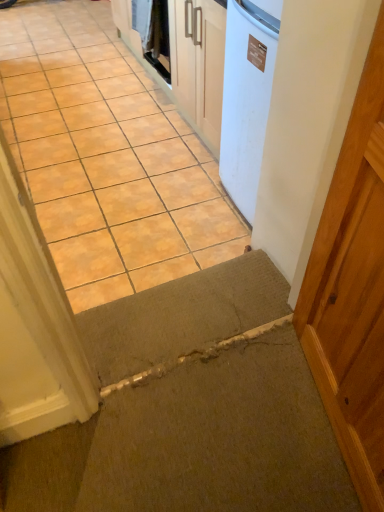
Question: Is white glossy washing machine at upper center bigger than carpeted mat at lower center?

Choices:
 (A) no
 (B) yes

Answer: (A)

Question: Considering the relative positions of white glossy washing machine at upper center and carpeted mat at lower center in the image provided, is white glossy washing machine at upper center to the right of carpeted mat at lower center from the viewer's perspective?

Choices:
 (A) yes
 (B) no

Answer: (B)

Question: From the image's perspective, does white glossy washing machine at upper center appear lower than carpeted mat at lower center?

Choices:
 (A) yes
 (B) no

Answer: (B)

Question: Considering the relative sizes of white glossy washing machine at upper center and carpeted mat at lower center in the image provided, is white glossy washing machine at upper center taller than carpeted mat at lower center?

Choices:
 (A) yes
 (B) no

Answer: (A)

Question: Does white glossy washing machine at upper center have a smaller size compared to carpeted mat at lower center?

Choices:
 (A) no
 (B) yes

Answer: (B)

Question: From the image's perspective, would you say white glossy washing machine at upper center is positioned over carpeted mat at lower center?

Choices:
 (A) no
 (B) yes

Answer: (B)

Question: Can you confirm if brown concrete at center is taller than white glossy washing machine at upper center?

Choices:
 (A) no
 (B) yes

Answer: (A)

Question: Are brown concrete at center and white glossy washing machine at upper center beside each other?

Choices:
 (A) no
 (B) yes

Answer: (A)

Question: Is the position of brown concrete at center less distant than that of white glossy washing machine at upper center?

Choices:
 (A) no
 (B) yes

Answer: (B)

Question: Is brown concrete at center bigger than white glossy washing machine at upper center?

Choices:
 (A) no
 (B) yes

Answer: (B)

Question: Is brown concrete at center oriented away from white glossy washing machine at upper center?

Choices:
 (A) yes
 (B) no

Answer: (B)

Question: Considering the relative sizes of brown concrete at center and white glossy washing machine at upper center in the image provided, is brown concrete at center thinner than white glossy washing machine at upper center?

Choices:
 (A) yes
 (B) no

Answer: (B)

Question: Is brown concrete at center positioned with its back to carpeted mat at lower center?

Choices:
 (A) no
 (B) yes

Answer: (A)